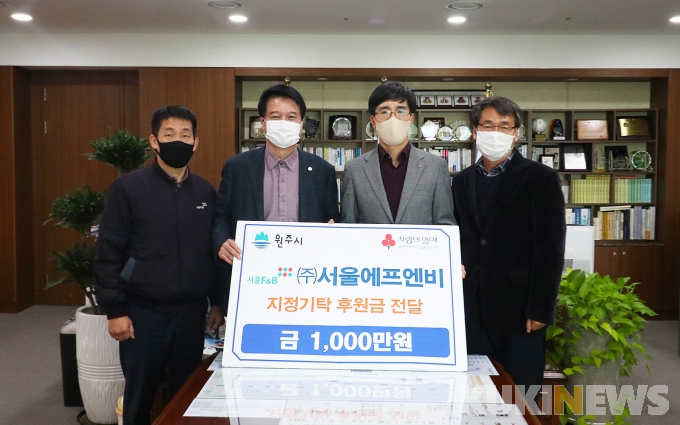
The height and width of the screenshot is (425, 680). Find the location of `desk`. desk is located at coordinates (228, 394).